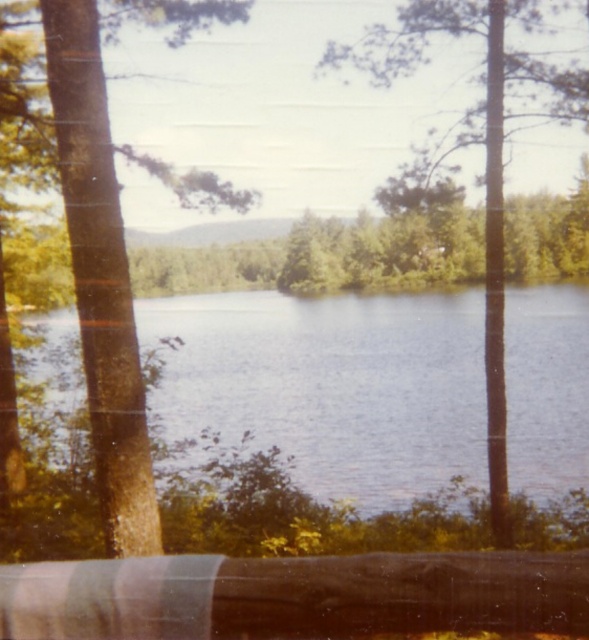
From the picture: Between brown textured tree at left and green leafy tree at center, which one has less height?

brown textured tree at left is shorter.

Between brown textured tree at left and green leafy tree at center, which one is positioned higher?

green leafy tree at center is higher up.

The image size is (589, 640). Find the location of `brown textured tree at left`. brown textured tree at left is located at coordinates (107, 236).

Is blue water at center below green leafy tree at center?

Indeed, blue water at center is positioned under green leafy tree at center.

Looking at this image, is blue water at center positioned before green leafy tree at center?

That is True.

Find the location of a particular element. This screenshot has width=589, height=640. blue water at center is located at coordinates (329, 385).

How distant is blue water at center from brown textured tree at left?

28.12 meters

Consider the image. Who is shorter, blue water at center or brown textured tree at left?

brown textured tree at left is shorter.

Between point (319, 314) and point (2, 99), which one is positioned behind?

The point (319, 314) is more distant.

Locate an element on the screen. The height and width of the screenshot is (640, 589). blue water at center is located at coordinates (329, 385).